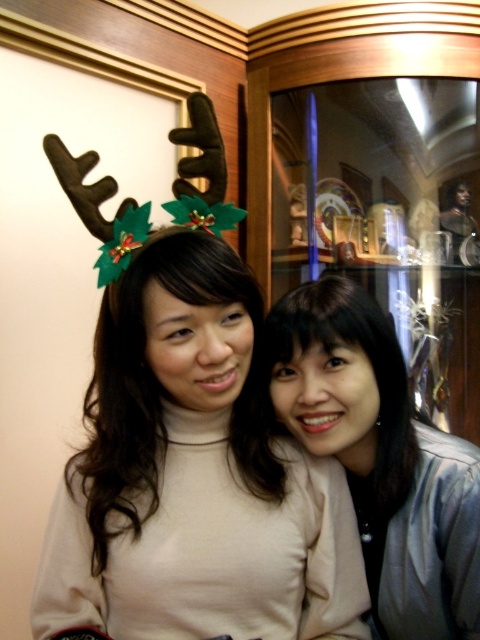
Is matte brown antlers at center shorter than matte beige sweater at center?

In fact, matte brown antlers at center may be taller than matte beige sweater at center.

Who is higher up, matte brown antlers at center or matte beige sweater at center?

matte brown antlers at center is higher up.

Describe the element at coordinates (189, 445) in the screenshot. This screenshot has height=640, width=480. I see `matte brown antlers at center` at that location.

Where is `matte brown antlers at center`? The width and height of the screenshot is (480, 640). matte brown antlers at center is located at coordinates [189, 445].